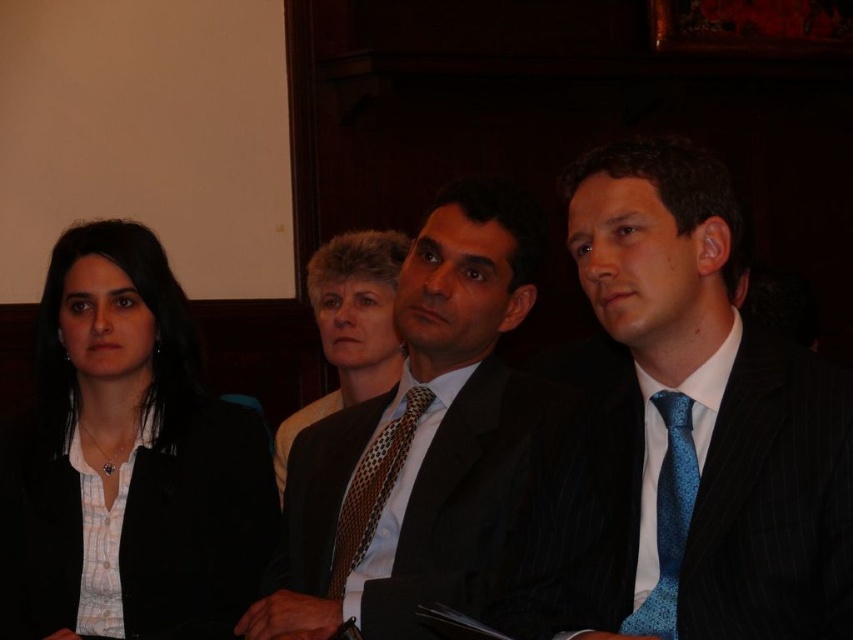
Who is positioned more to the right, matte black jacket at left or matte white shirt at center?

matte white shirt at center

Does matte black jacket at left have a smaller size compared to matte white shirt at center?

No, matte black jacket at left is not smaller than matte white shirt at center.

Is point (55, 340) in front of point (344, 276)?

That is True.

Locate an element on the screen. matte black jacket at left is located at coordinates (126, 461).

How distant is matte black jacket at left from brown dotted tie at center?

matte black jacket at left and brown dotted tie at center are 21.93 inches apart.

Is point (224, 616) farther from camera compared to point (349, 561)?

Yes, it is.

Identify the location of matte black jacket at left. (126, 461).

Does blue textured tie at right appear under brown dotted tie at center?

Incorrect, blue textured tie at right is not positioned below brown dotted tie at center.

This screenshot has width=853, height=640. What do you see at coordinates (669, 516) in the screenshot?
I see `blue textured tie at right` at bounding box center [669, 516].

At what (x,y) coordinates should I click in order to perform the action: click on blue textured tie at right. Please return your answer as a coordinate pair (x, y). The height and width of the screenshot is (640, 853). Looking at the image, I should click on (669, 516).